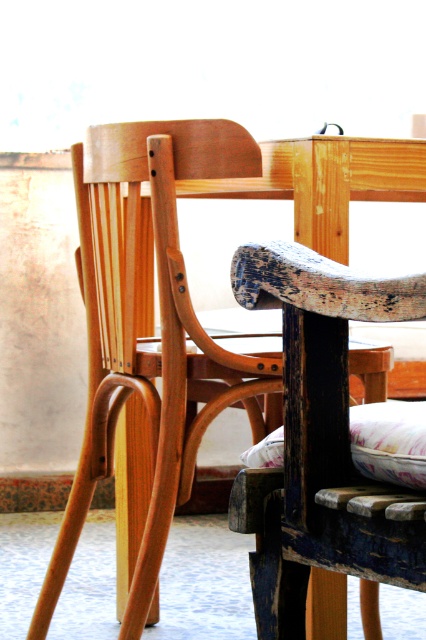
Can you confirm if natural wood chair at center is positioned above floral fabric cushion at lower center?

Incorrect, natural wood chair at center is not positioned above floral fabric cushion at lower center.

From the picture: Can you confirm if natural wood chair at center is positioned to the left of floral fabric cushion at lower center?

Indeed, natural wood chair at center is positioned on the left side of floral fabric cushion at lower center.

The height and width of the screenshot is (640, 426). Find the location of `natural wood chair at center`. natural wood chair at center is located at coordinates (161, 317).